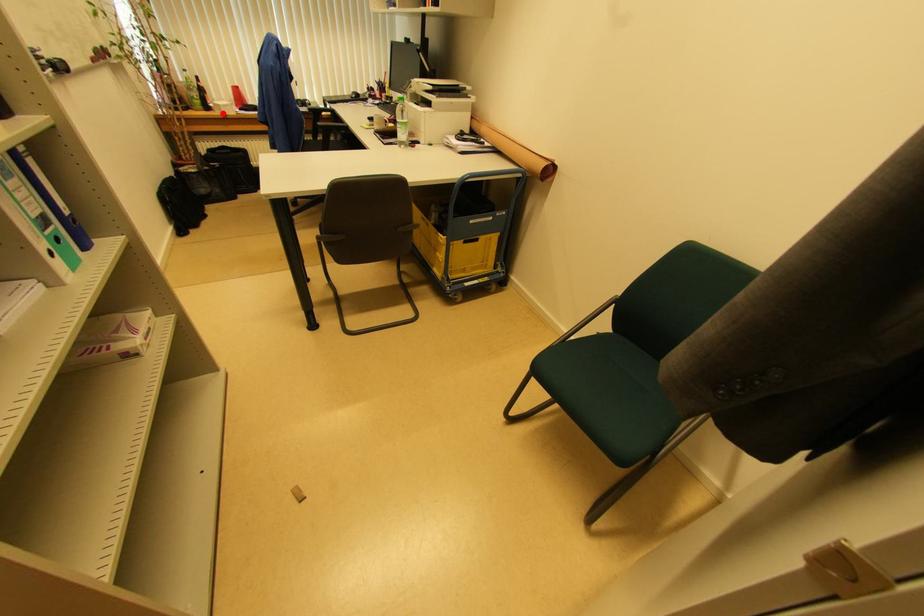
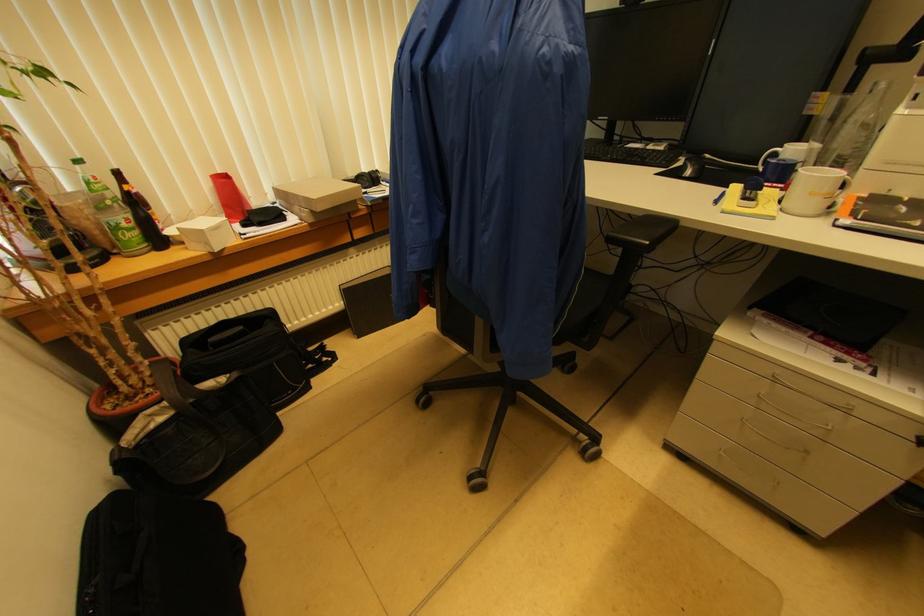
Where in the second image is the point corresponding to the highlighted location from the first image?

(209, 246)